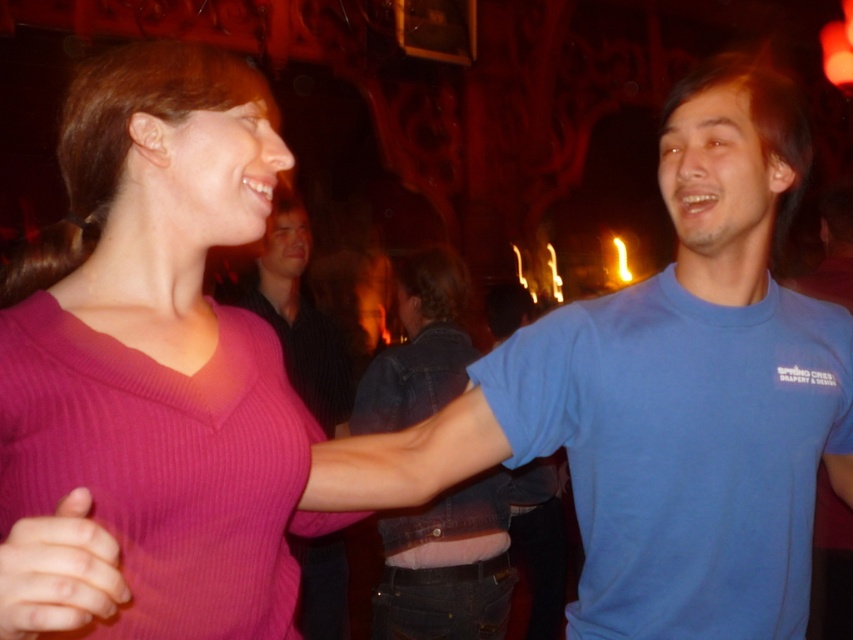
Does blue cotton t-shirt at center appear on the right side of pink ribbed sweater at lower left?

No, blue cotton t-shirt at center is not to the right of pink ribbed sweater at lower left.

Who is positioned more to the left, blue cotton t-shirt at center or pink ribbed sweater at lower left?

blue cotton t-shirt at center

Does point (338, 584) lie behind point (59, 513)?

Yes.

What are the coordinates of `blue cotton t-shirt at center` in the screenshot? It's located at (299, 316).

From the picture: Is pink ribbed sweater at center wider than blue cotton t-shirt at center?

Yes, pink ribbed sweater at center is wider than blue cotton t-shirt at center.

Looking at this image, does pink ribbed sweater at center have a smaller size compared to blue cotton t-shirt at center?

Yes.

Between point (125, 296) and point (306, 564), which one is positioned in front?

Point (125, 296)

Identify the location of pink ribbed sweater at center. (160, 339).

Who is positioned more to the right, pink ribbed sweater at center or pink ribbed sweater at lower left?

pink ribbed sweater at lower left is more to the right.

Which is below, pink ribbed sweater at center or pink ribbed sweater at lower left?

pink ribbed sweater at lower left is lower down.

Which is in front, point (172, 579) or point (21, 557)?

Point (21, 557) is more forward.

The height and width of the screenshot is (640, 853). What are the coordinates of `pink ribbed sweater at center` in the screenshot? It's located at tap(160, 339).